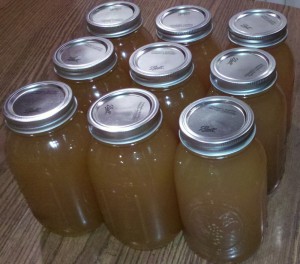
At what (x,y) coordinates should I click in order to perform the action: click on center row of jars. Please return your answer as a coordinate pair (x, y). The height and width of the screenshot is (264, 300). Looking at the image, I should click on pyautogui.click(x=89, y=89), pyautogui.click(x=173, y=92), pyautogui.click(x=265, y=107).